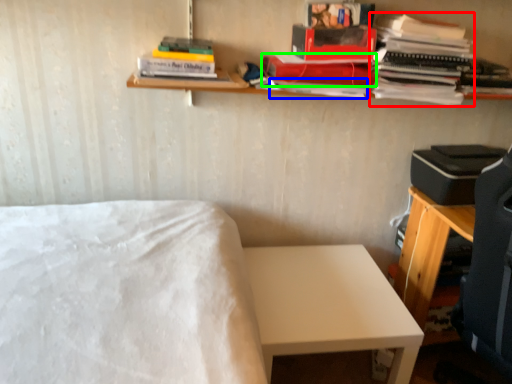
Question: Which object is positioned closest to book (highlighted by a red box)? Select from paperback book (highlighted by a blue box) and paperback book (highlighted by a green box).

Choices:
 (A) paperback book
 (B) paperback book

Answer: (B)